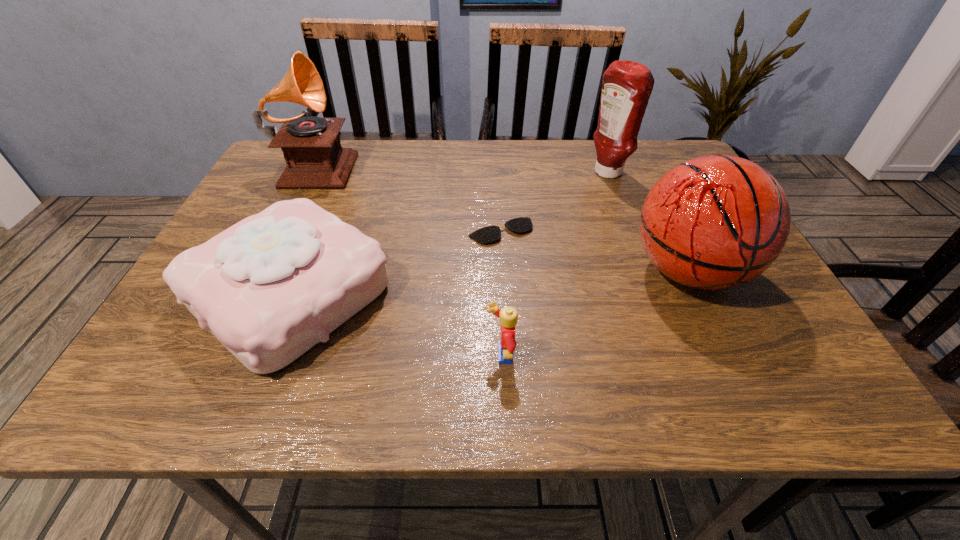
Identify the location of phonograph record. (311, 146).

The image size is (960, 540). In order to click on condiment in this screenshot , I will do `click(627, 86)`.

Locate an element on the screen. Image resolution: width=960 pixels, height=540 pixels. basketball is located at coordinates (714, 222).

At what (x,y) coordinates should I click in order to perform the action: click on cake. Please return your answer as a coordinate pair (x, y). The height and width of the screenshot is (540, 960). Looking at the image, I should click on (270, 287).

Identify the location of Lego. The image size is (960, 540). (508, 316).

Find the location of a particular element. spectacles is located at coordinates (489, 234).

At what (x,y) coordinates should I click in order to perform the action: click on vacant space located on the horn of the phonograph record. Please return your answer as a coordinate pair (x, y). Looking at the image, I should click on (423, 164).

What are the coordinates of `free space located 0.220m on the front of the condiment` in the screenshot? It's located at (633, 239).

Find the location of a particular element. Image resolution: width=960 pixels, height=540 pixels. free space located 0.170m on the side with spill of the basketball is located at coordinates (750, 399).

What are the coordinates of `vacant region located 0.310m on the right of the cake` in the screenshot? It's located at (546, 293).